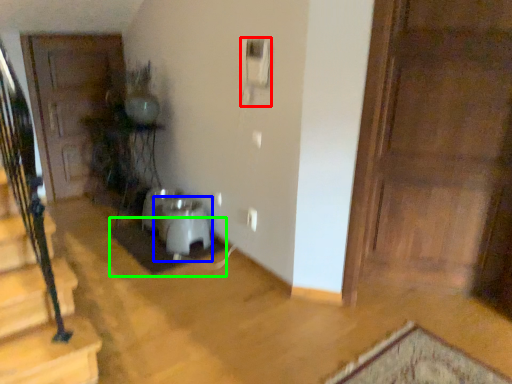
Question: Which is farther away from corded phone (highlighted by a red box)? water heater (highlighted by a blue box) or doormat (highlighted by a green box)?

Choices:
 (A) water heater
 (B) doormat

Answer: (B)